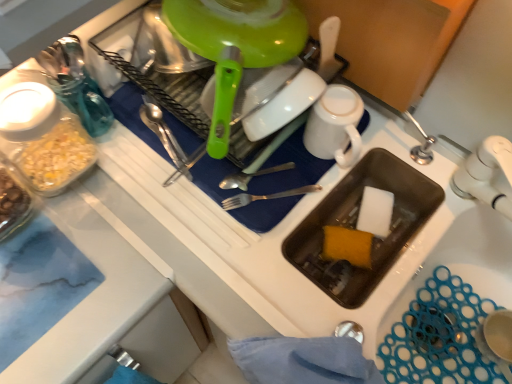
At what (x,y) coordinates should I click in order to perform the action: click on free spot to the left of silver metallic fork at center. Please return your answer as a coordinate pair (x, y). Image resolution: width=512 pixels, height=384 pixels. Looking at the image, I should click on [174, 198].